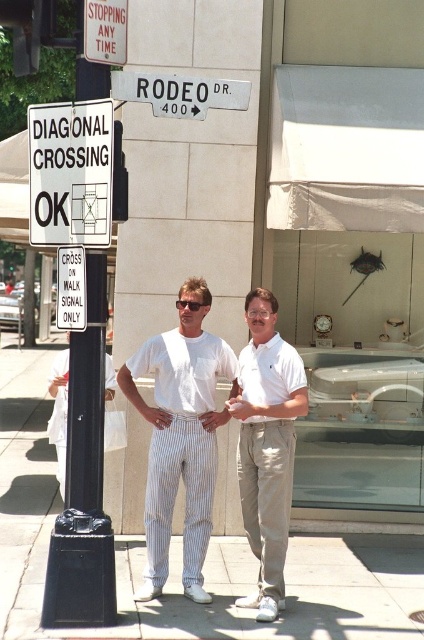
You are standing at the point with coordinates point (81, 282) and want to walk towards the point (151, 97). According to the spatial relationship between them, which direction should you face to move towards it?

Since point (151, 97) is in front of point (81, 282), you should face the direction towards point (151, 97) to move forward towards it.